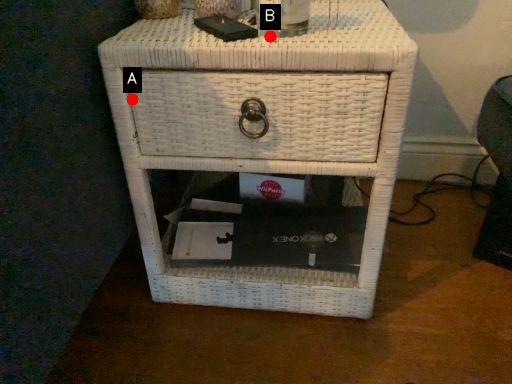
Question: Two points are circled on the image, labeled by A and B beside each circle. Which point is closer to the camera?

Choices:
 (A) A is closer
 (B) B is closer

Answer: (A)